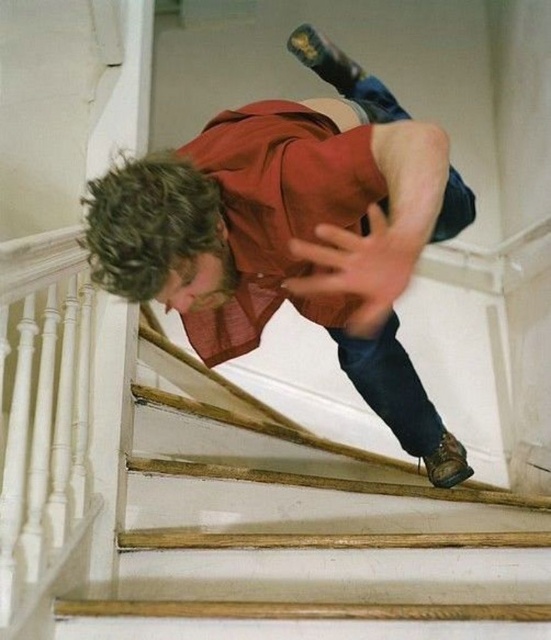
You are standing at the bottom of the staircase and want to reach the top. There are two points marked on the staircase railings at coordinates point [445,580] and point [152,230]. Which point is closer to you as you look up the staircase?

Point [152,230] is closer to you because it is less further to the viewer than point [445,580].

You are a safety inspector evaluating the staircase scene. The wooden stairs at center must be at least 1.2 meters tall for compliance. The matte red shirt at center is 1.5 meters in height. Can the staircase meet the safety standard based on their heights?

The wooden stairs at center is not as tall as the matte red shirt at center, which is 1.5 meters. Since the required height is 1.2 meters, the staircase is shorter than the shirt but may still meet the standard if its height is at least 1.2 meters. However, without knowing the exact height of the stairs, we cannot confirm compliance.